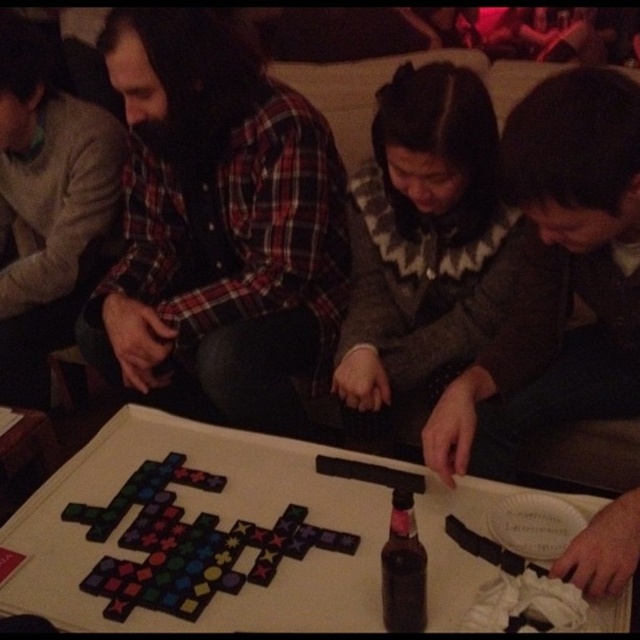
Is plaid flannel shirt at center above white matte table at center?

Yes, plaid flannel shirt at center is above white matte table at center.

What do you see at coordinates (218, 225) in the screenshot? I see `plaid flannel shirt at center` at bounding box center [218, 225].

Where is `plaid flannel shirt at center`? plaid flannel shirt at center is located at coordinates (218, 225).

Does plaid flannel shirt at center appear on the left side of fuzzy gray sweater at center?

Yes, plaid flannel shirt at center is to the left of fuzzy gray sweater at center.

Which is more to the right, plaid flannel shirt at center or fuzzy gray sweater at center?

fuzzy gray sweater at center

You are a GUI agent. You are given a task and a screenshot of the screen. Output one action in this format:
    pyautogui.click(x=<x>, y=<y>)
    Task: Click on the plaid flannel shirt at center
    This screenshot has height=640, width=640.
    Given the screenshot: What is the action you would take?
    pyautogui.click(x=218, y=225)

Is dark brown leather jacket at lower right to the right of multicolored plastic game pieces at center from the viewer's perspective?

Indeed, dark brown leather jacket at lower right is positioned on the right side of multicolored plastic game pieces at center.

Is dark brown leather jacket at lower right smaller than multicolored plastic game pieces at center?

No, dark brown leather jacket at lower right is not smaller than multicolored plastic game pieces at center.

Which is behind, point (500, 378) or point (77, 509)?

Point (500, 378)

Locate an element on the screen. dark brown leather jacket at lower right is located at coordinates (557, 276).